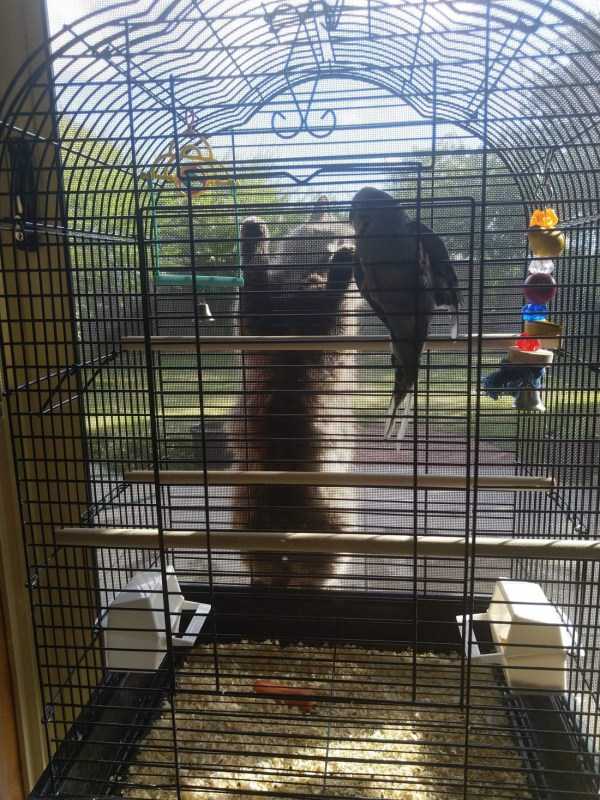
At what (x,y) coordinates should I click in order to perform the action: click on flower pot. Please return your answer as a coordinate pair (x, y). Looking at the image, I should click on (219, 450).